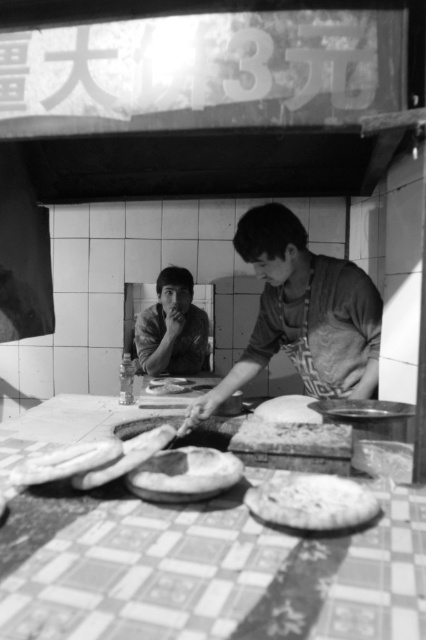
Identify the location of soft white dough at center. click(126, 458).

Can you confirm if soft white dough at center is wider than soft dough at center?

No.

Is point (114, 460) more distant than point (270, 404)?

No.

The image size is (426, 640). Identify the location of soft white dough at center. (126, 458).

Can you confirm if checkerboard-patterned table at center is positioned to the left of smooth dough at center?

Yes, checkerboard-patterned table at center is to the left of smooth dough at center.

Find the location of `checkerboard-patterned table at center`. checkerboard-patterned table at center is located at coordinates (218, 573).

Where is `checkerboard-patterned table at center`? Image resolution: width=426 pixels, height=640 pixels. checkerboard-patterned table at center is located at coordinates (218, 573).

Where is `checkerboard-patterned table at center`? checkerboard-patterned table at center is located at coordinates (218, 573).

Is smooth apron at center further to camera compared to soft white dough at center?

Yes, smooth apron at center is further from the viewer.

Is smooth apron at center thinner than soft white dough at center?

No.

Where is `smooth apron at center`? smooth apron at center is located at coordinates (302, 314).